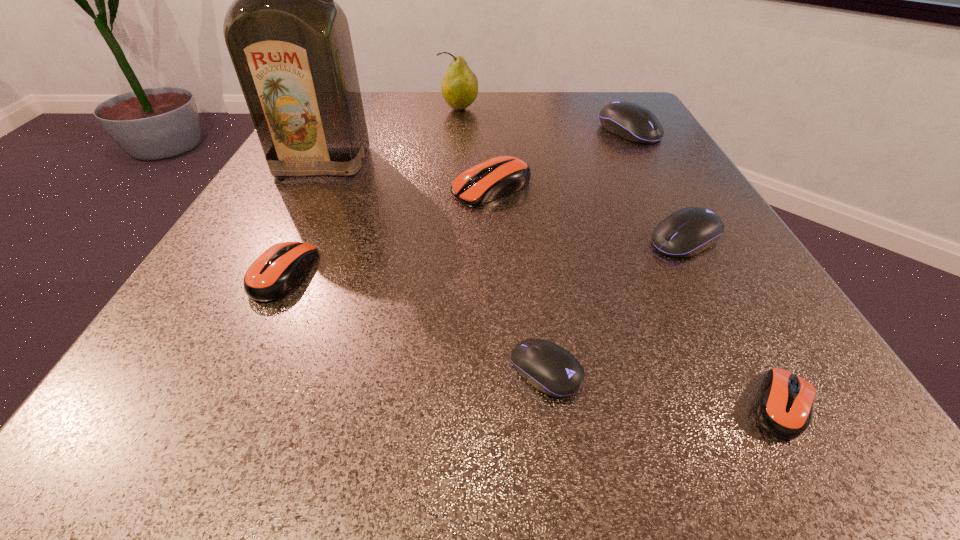
Image resolution: width=960 pixels, height=540 pixels. In order to click on free region at the right edge of the desktop in this screenshot , I will do `click(747, 273)`.

Image resolution: width=960 pixels, height=540 pixels. What are the coordinates of `vacant area at the far right corner` in the screenshot? It's located at (576, 97).

Find the location of a particular element. The image size is (960, 540). vacant space at the near right corner of the desktop is located at coordinates (847, 402).

Where is `vacant space that's between the smallest black computer mouse and the second biggest black computer mouse`? This screenshot has width=960, height=540. vacant space that's between the smallest black computer mouse and the second biggest black computer mouse is located at coordinates (615, 305).

I want to click on free spot between the farthest object and the fifth nearest computer mouse, so click(x=475, y=148).

Locate an element on the screen. empty space between the second biggest black computer mouse and the tallest object is located at coordinates (504, 201).

Where is `vacant space in between the rightmost orange computer mouse and the tallest object`? The height and width of the screenshot is (540, 960). vacant space in between the rightmost orange computer mouse and the tallest object is located at coordinates (554, 283).

The image size is (960, 540). Find the location of `free space between the liquor and the second smallest black computer mouse`. free space between the liquor and the second smallest black computer mouse is located at coordinates (504, 201).

You are a GUI agent. You are given a task and a screenshot of the screen. Output one action in this format:
    pyautogui.click(x=<x>, y=<y>)
    Task: Click on the empty location between the liquor and the second tallest object
    The image size is (960, 540).
    Given the screenshot: What is the action you would take?
    pyautogui.click(x=392, y=136)

Locate an element on the screen. The width and height of the screenshot is (960, 540). empty space that is in between the leftmost black computer mouse and the second farthest black computer mouse is located at coordinates (615, 305).